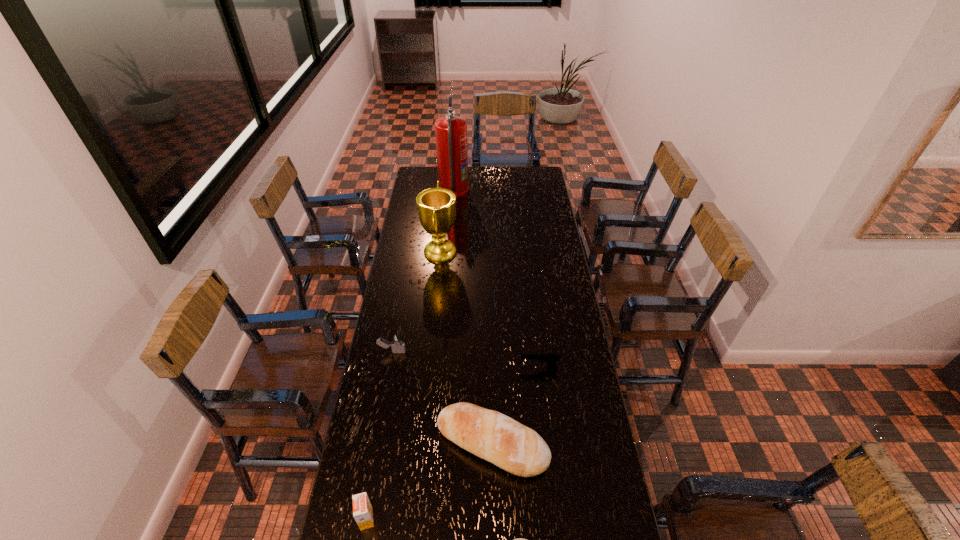
I want to click on free spot between the fire extinguisher and the sixth farthest object, so click(410, 355).

Image resolution: width=960 pixels, height=540 pixels. I want to click on vacant space in between the igniter and the orange juice, so click(379, 435).

I want to click on empty space that is in between the bread and the fire extinguisher, so click(473, 317).

Find the location of a particular element. vacant space in between the award and the fifth nearest object is located at coordinates (417, 301).

Image resolution: width=960 pixels, height=540 pixels. I want to click on the closest object to the nearest object, so click(x=490, y=435).

The image size is (960, 540). Find the location of `object that can be found as the second closest to the fourth nearest object`. object that can be found as the second closest to the fourth nearest object is located at coordinates (397, 344).

In order to click on vacant space that satisfies the following two spatial constraints: 1. on the instruction side of the bread; 2. on the right side of the farthest object in this screenshot , I will do `click(434, 443)`.

What are the coordinates of `free space in the image that satisfies the following two spatial constraints: 1. on the shiny surface of the sixth nearest object; 2. on the left side of the third nearest object` in the screenshot? It's located at [x=420, y=443].